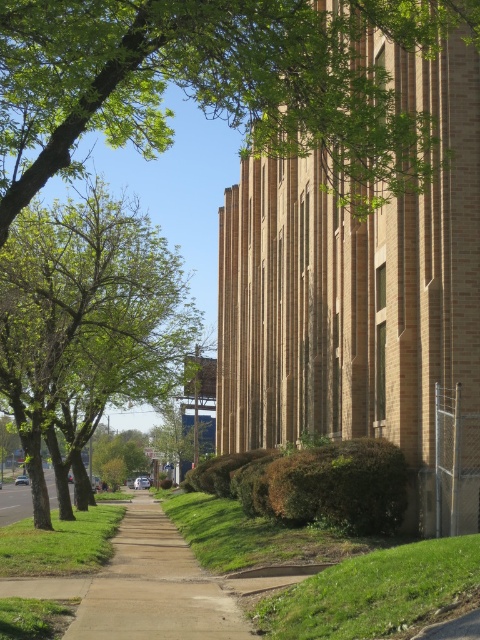
You are standing at the point marked by the coordinates (156, 588) on the image. What object are you standing on?

You are standing on the brown concrete sidewalk at center marked by the point (156, 588).

You are a gardener inspecting the lawn in front of the building. You notice two sections of green grass at lower center and green grass at lower left. Which section requires more frequent mowing based on their current heights?

The green grass at lower center requires more frequent mowing because it has a lesser height compared to the green grass at lower left, indicating it might need maintenance to maintain an even appearance.

You are standing on the sidewalk and looking towards the building. Which object is higher up in the image, the green leafy tree at left or the green grass at lower center?

The green leafy tree at left is higher up than the green grass at lower center in the image.